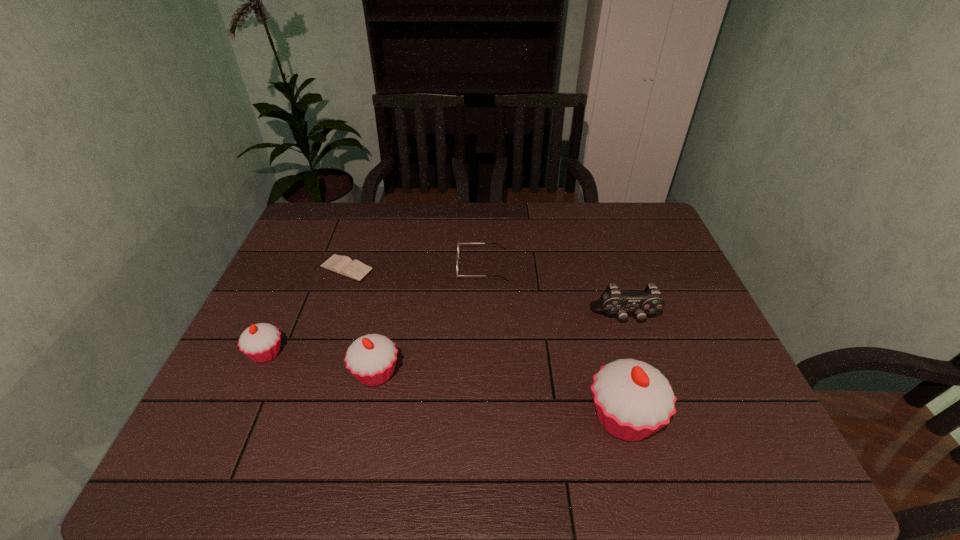
You are a GUI agent. You are given a task and a screenshot of the screen. Output one action in this format:
    pyautogui.click(x=<x>, y=<y>)
    Task: Click on the empty space between the tallest object and the second cupcake from left to right
    The image size is (960, 540).
    Given the screenshot: What is the action you would take?
    pyautogui.click(x=500, y=395)

The height and width of the screenshot is (540, 960). I want to click on vacant space that is in between the third object from right to left and the second cupcake from right to left, so click(429, 320).

Find the location of a particular element. The image size is (960, 540). object that ranks as the fifth closest to the leftmost cupcake is located at coordinates (613, 301).

Select which object is the fourth closest to the fourth object from right to left. Please provide its 2D coordinates. Your answer should be formatted as a tuple, i.e. [(x, y)], where the tuple contains the x and y coordinates of a point satisfying the conditions above.

[(633, 400)]

Locate which cupcake is the second closest to the tallest object. Please provide its 2D coordinates. Your answer should be formatted as a tuple, i.e. [(x, y)], where the tuple contains the x and y coordinates of a point satisfying the conditions above.

[(260, 342)]

The image size is (960, 540). I want to click on cupcake that is the second closest to the rightmost cupcake, so click(260, 342).

Where is `vacant region that satisfies the following two spatial constraints: 1. on the front side of the tallest cupcake; 2. on the left side of the shortest object`? The height and width of the screenshot is (540, 960). vacant region that satisfies the following two spatial constraints: 1. on the front side of the tallest cupcake; 2. on the left side of the shortest object is located at coordinates (296, 417).

Locate an element on the screen. free point that satisfies the following two spatial constraints: 1. on the front side of the diary; 2. on the left side of the fourth object from right to left is located at coordinates (311, 373).